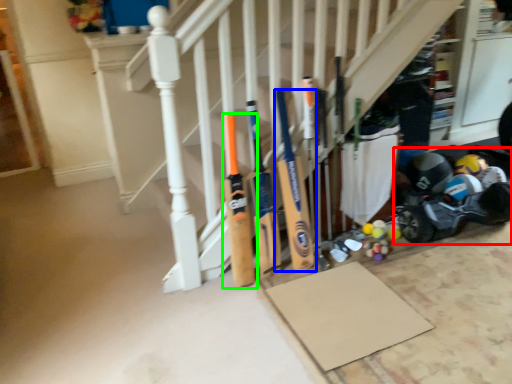
Question: Based on their relative distances, which object is farther from baby carriage (highlighted by a red box)? Choose from baseball bat (highlighted by a blue box) and baseball bat (highlighted by a green box).

Choices:
 (A) baseball bat
 (B) baseball bat

Answer: (B)